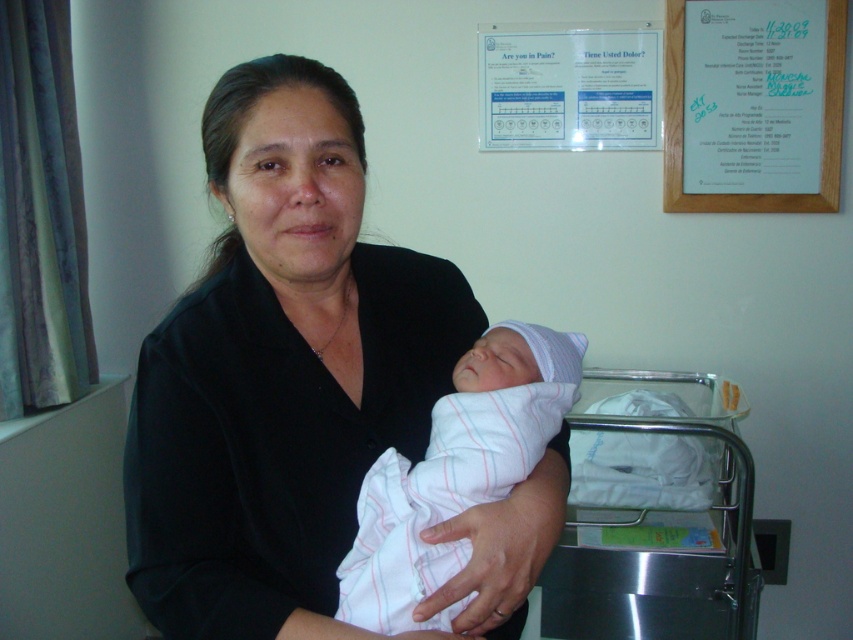
You are a nurse in a hospital room. You need to place a medical form on the nearest flat surface. The white paper at upper right and the white striped fabric newborn at center are both visible. Which surface can you use?

The white paper at upper right has a larger size compared to the white striped fabric newborn at center, so you can place the medical form on the white paper at upper right.

You are a nurse in a hospital room. You need to hang a chart on the wall next to the white paper at upper right and the white striped fabric newborn at center. Which object is taller so you can place the chart appropriately?

The white paper at upper right is taller than the white striped fabric newborn at center, so you should place the chart next to the white paper at upper right since it has more vertical space available.

You are a nurse in a hospital room. You need to move the white striped fabric newborn at center to the stainless steel hospital bed at lower right. Is the bed positioned below the newborn?

The stainless steel hospital bed at lower right is located below the white striped fabric newborn at center, so yes, the bed is positioned below the newborn.